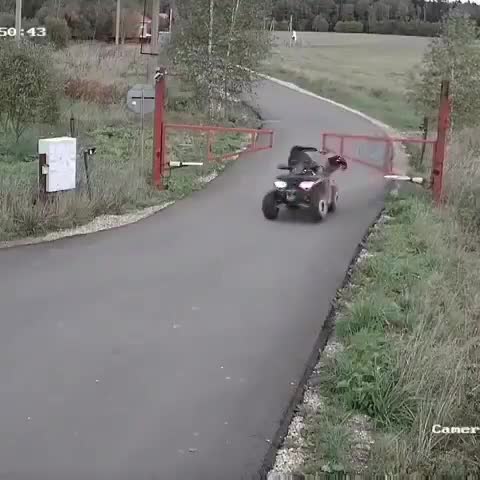
Identify the location of junction box. Image resolution: width=480 pixels, height=480 pixels. pyautogui.click(x=62, y=155).